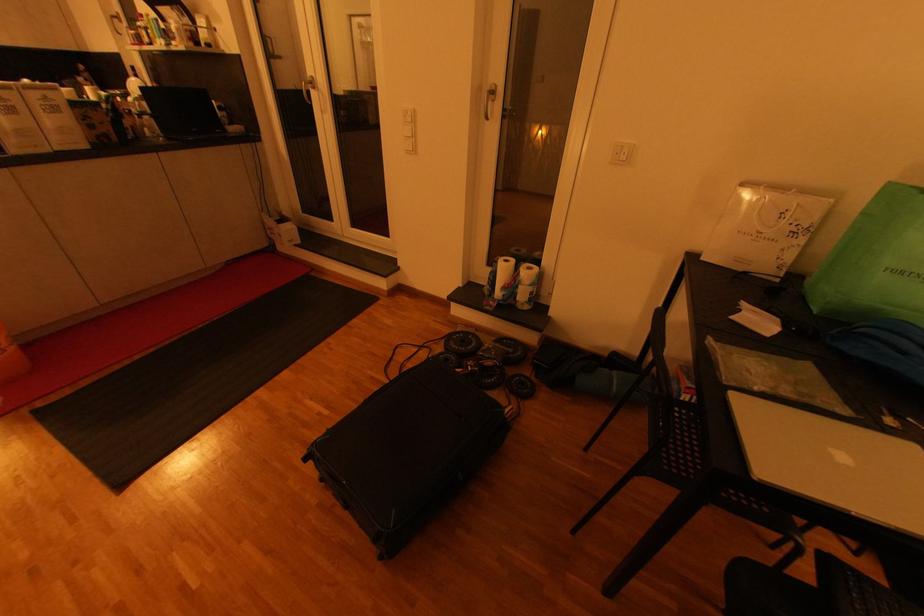
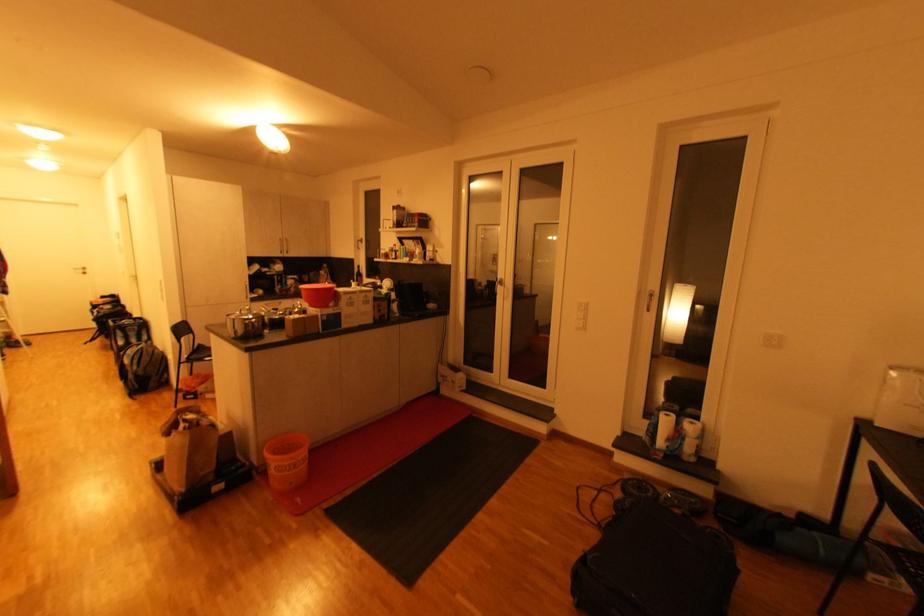
The images are taken continuously from a first-person perspective. In which direction are you moving?

The cameraman moved toward left, backward.